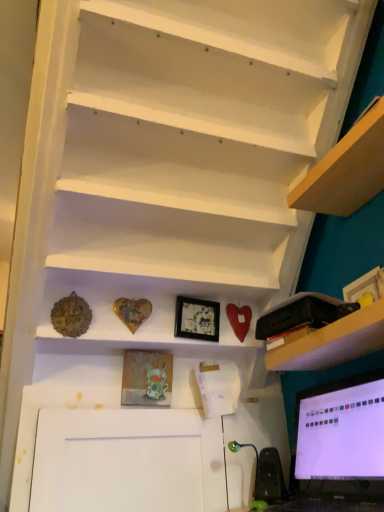
Question: From the image's perspective, is green rubber speaker at lower right under white matte stairs at upper center?

Choices:
 (A) yes
 (B) no

Answer: (A)

Question: Would you consider green rubber speaker at lower right to be distant from white matte stairs at upper center?

Choices:
 (A) yes
 (B) no

Answer: (A)

Question: Is green rubber speaker at lower right facing away from white matte stairs at upper center?

Choices:
 (A) no
 (B) yes

Answer: (A)

Question: Is green rubber speaker at lower right at the right side of white matte stairs at upper center?

Choices:
 (A) no
 (B) yes

Answer: (B)

Question: From the image's perspective, is green rubber speaker at lower right located above white matte stairs at upper center?

Choices:
 (A) yes
 (B) no

Answer: (B)

Question: Does point (281, 496) appear closer or farther from the camera than point (213, 285)?

Choices:
 (A) farther
 (B) closer

Answer: (B)

Question: Is green rubber speaker at lower right inside the boundaries of wooden heart at center, or outside?

Choices:
 (A) outside
 (B) inside

Answer: (A)

Question: Considering their positions, is green rubber speaker at lower right located in front of or behind wooden heart at center?

Choices:
 (A) front
 (B) behind

Answer: (B)

Question: Considering the positions of green rubber speaker at lower right and wooden heart at center in the image, is green rubber speaker at lower right taller or shorter than wooden heart at center?

Choices:
 (A) short
 (B) tall

Answer: (A)

Question: From a real-world perspective, is wooden textured picture frame at center, the 1th picture frame positioned from the bottom, positioned above or below green rubber speaker at lower right?

Choices:
 (A) below
 (B) above

Answer: (B)

Question: Considering the positions of wooden textured picture frame at center, which appears as the second picture frame when viewed from the right, and green rubber speaker at lower right in the image, is wooden textured picture frame at center, which appears as the second picture frame when viewed from the right, taller or shorter than green rubber speaker at lower right?

Choices:
 (A) short
 (B) tall

Answer: (B)

Question: From the image's perspective, relative to green rubber speaker at lower right, is wooden textured picture frame at center, the first picture frame viewed from the left, above or below?

Choices:
 (A) above
 (B) below

Answer: (A)

Question: Considering the positions of wooden textured picture frame at center, the 2th picture frame from the top, and green rubber speaker at lower right in the image, is wooden textured picture frame at center, the 2th picture frame from the top, wider or thinner than green rubber speaker at lower right?

Choices:
 (A) thin
 (B) wide

Answer: (A)

Question: Do you think green rubber speaker at lower right is within white matte stairs at upper center, or outside of it?

Choices:
 (A) outside
 (B) inside

Answer: (A)

Question: From the image's perspective, is green rubber speaker at lower right located above or below white matte stairs at upper center?

Choices:
 (A) below
 (B) above

Answer: (A)